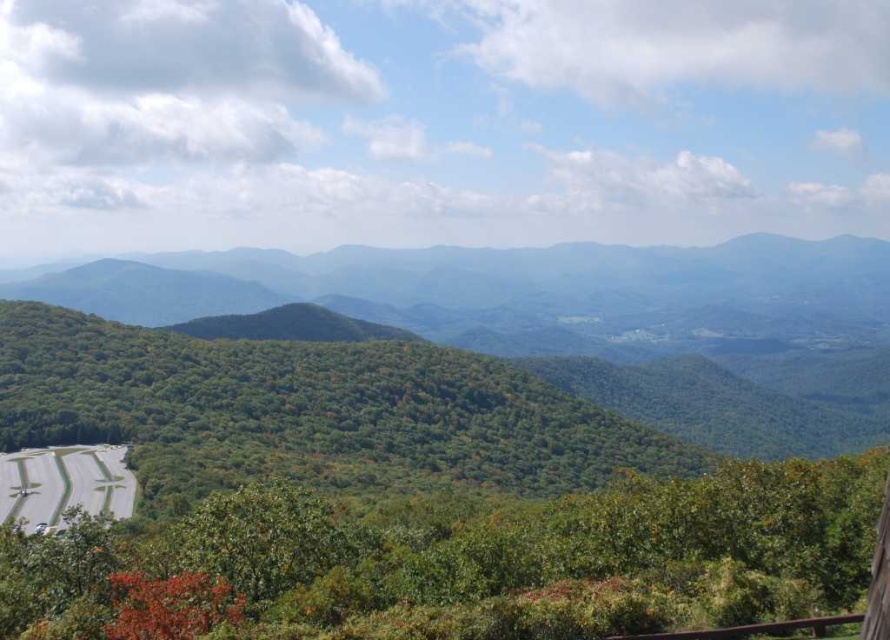
Based on the coordinates provided, which object is located at point (579, 321) in the scene?

The point (579, 321) indicates green leafy forest at left.

You are a hiker planning to walk from the green asphalt road at lower left to the green leafy forest at left. Given that your average walking speed is 5 km per hour, approximately how long will it take you to reach the forest?

The distance between the green leafy forest at left and the green asphalt road at lower left is 394.15 meters. At a walking speed of 5 km per hour, it would take approximately 4.7 minutes to reach the forest.